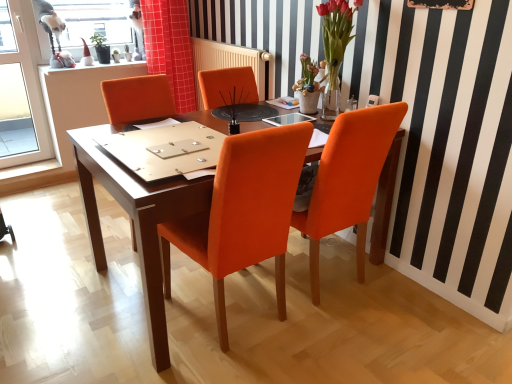
You are a GUI agent. You are given a task and a screenshot of the screen. Output one action in this format:
    pyautogui.click(x=<x>, y=<y>)
    Task: Click on the vacant area situated to the left side of matte wood desk at center
    The image size is (512, 384).
    Given the screenshot: What is the action you would take?
    pyautogui.click(x=62, y=279)